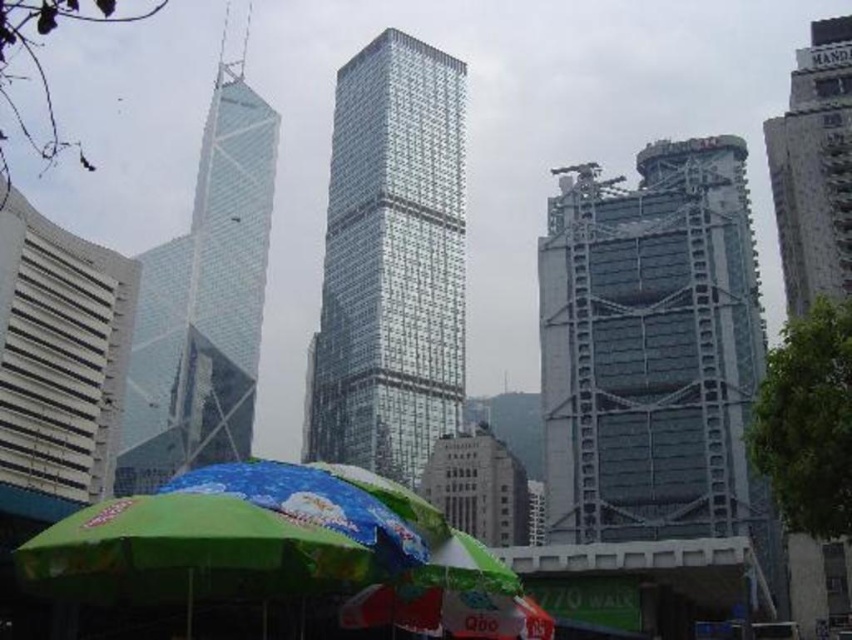
Consider the image. Between metallic scaffolding at right and white glass building at upper right, which one appears on the right side from the viewer's perspective?

white glass building at upper right is more to the right.

Who is taller, metallic scaffolding at right or white glass building at upper right?

metallic scaffolding at right is taller.

Does point (639, 176) lie in front of point (813, 278)?

No, (639, 176) is behind (813, 278).

Where is `metallic scaffolding at right`? This screenshot has height=640, width=852. metallic scaffolding at right is located at coordinates (654, 353).

Can you confirm if reflective glass skyscraper at center is positioned to the right of transparent glass skyscraper at left?

Yes, reflective glass skyscraper at center is to the right of transparent glass skyscraper at left.

The width and height of the screenshot is (852, 640). What are the coordinates of `reflective glass skyscraper at center` in the screenshot? It's located at (390, 262).

At what (x,y) coordinates should I click in order to perform the action: click on reflective glass skyscraper at center. Please return your answer as a coordinate pair (x, y). This screenshot has height=640, width=852. Looking at the image, I should click on (390, 262).

Between metallic scaffolding at right and transparent glass skyscraper at left, which one appears on the left side from the viewer's perspective?

transparent glass skyscraper at left

Does metallic scaffolding at right have a larger size compared to transparent glass skyscraper at left?

No.

You are a GUI agent. You are given a task and a screenshot of the screen. Output one action in this format:
    pyautogui.click(x=<x>, y=<y>)
    Task: Click on the metallic scaffolding at right
    This screenshot has width=852, height=640.
    Given the screenshot: What is the action you would take?
    (654, 353)

At what (x,y) coordinates should I click in order to perform the action: click on metallic scaffolding at right. Please return your answer as a coordinate pair (x, y). This screenshot has width=852, height=640. Looking at the image, I should click on (654, 353).